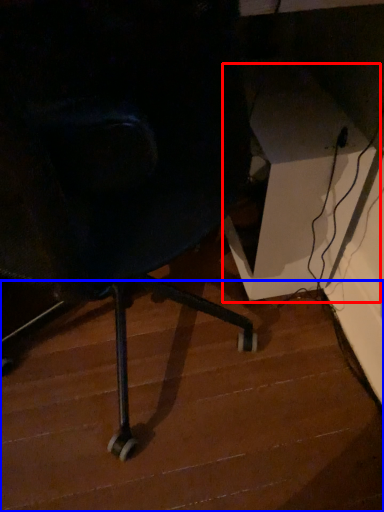
Question: Among these objects, which one is nearest to the camera, table (highlighted by a red box) or stair (highlighted by a blue box)?

Choices:
 (A) table
 (B) stair

Answer: (B)